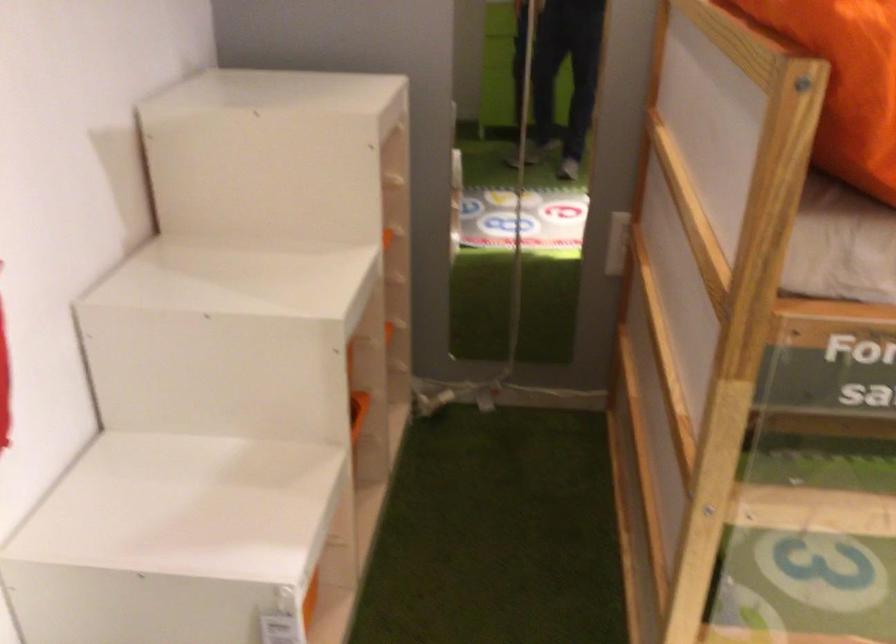
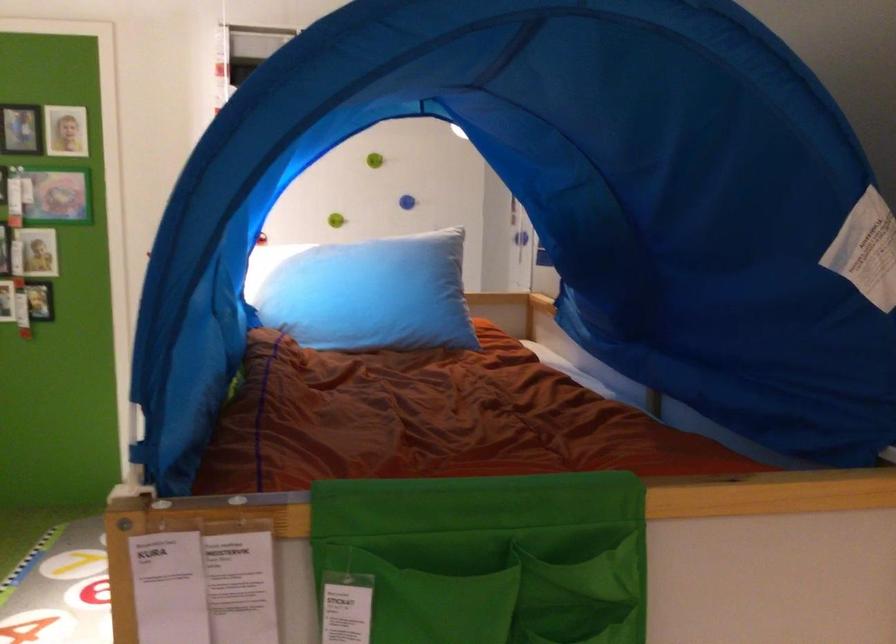
Question: I am providing you with two images of the same scene from different viewpoints. Please identify which objects are invisible in image2.

Choices:
 (A) light blue pillow
 (B) white potted plant
 (C) blue wall knob
 (D) orange storage bin

Answer: (D)